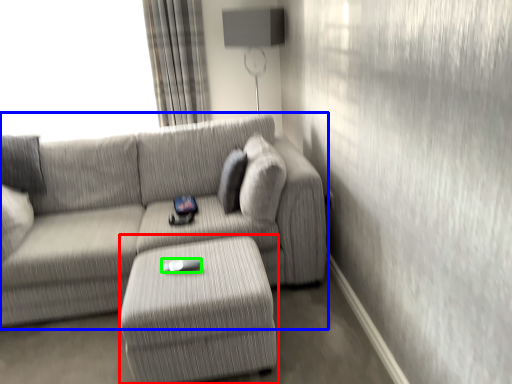
Question: Estimate the real-world distances between objects in this image. Which object is closer to table (highlighted by a red box), studio couch (highlighted by a blue box) or Wii controller (highlighted by a green box)?

Choices:
 (A) studio couch
 (B) Wii controller

Answer: (B)